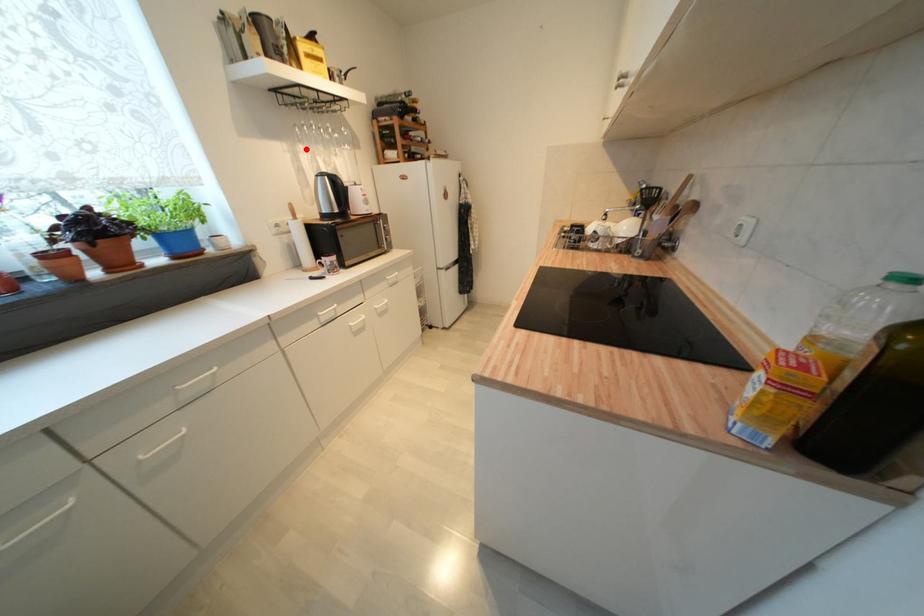
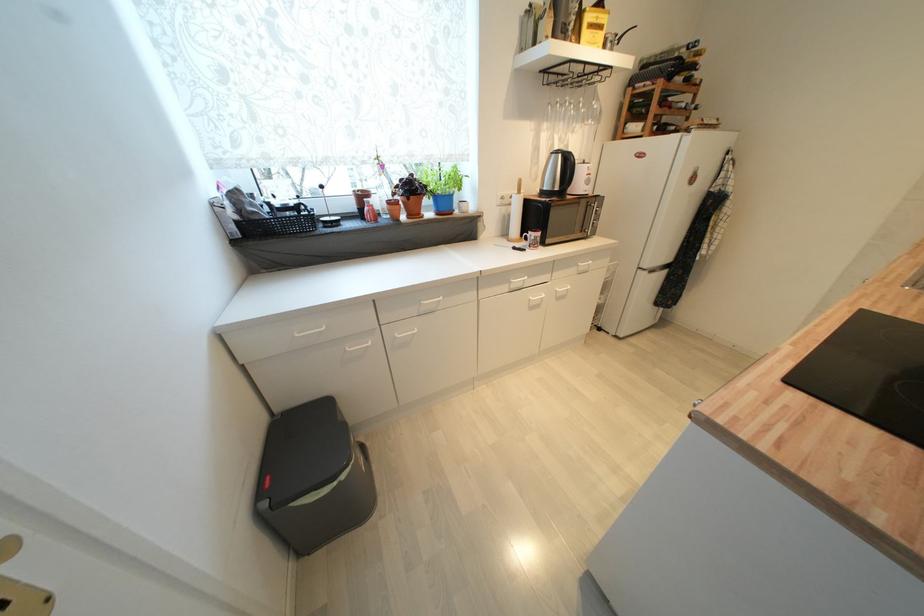
Find the pixel in the second image that matches the highlighted location in the first image.

(551, 127)